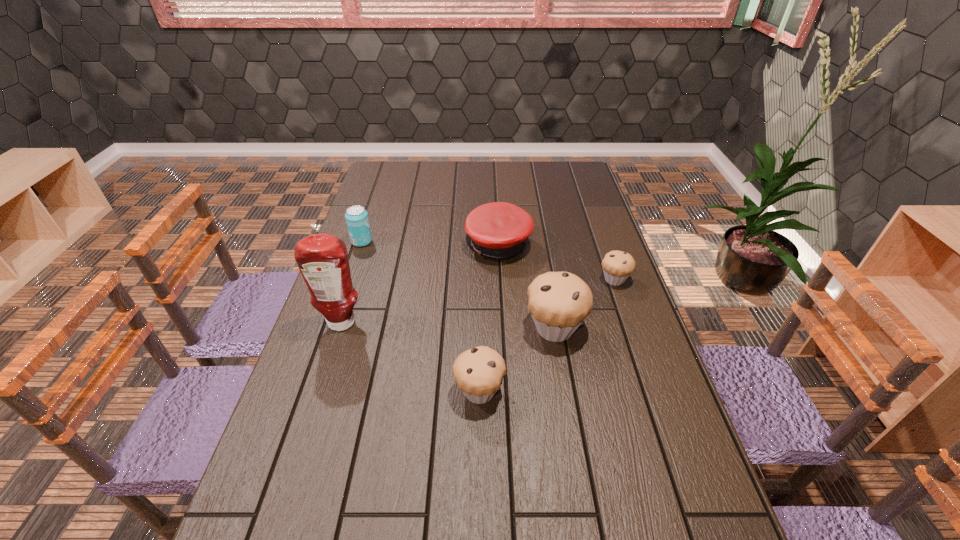
This screenshot has width=960, height=540. Identify the location of free space at the near edge of the desktop. (391, 523).

Locate an element on the screen. The image size is (960, 540). free space at the left edge of the desktop is located at coordinates (361, 292).

The image size is (960, 540). Find the location of `vacant space at the right edge of the desktop`. vacant space at the right edge of the desktop is located at coordinates (655, 396).

Where is `vacant region at the far left corner`? The height and width of the screenshot is (540, 960). vacant region at the far left corner is located at coordinates (396, 172).

The height and width of the screenshot is (540, 960). I want to click on blank region between the cap and the tallest object, so click(420, 284).

This screenshot has width=960, height=540. I want to click on vacant space that is in between the tallest muffin and the nearest muffin, so click(x=517, y=360).

Locate an element on the screen. This screenshot has width=960, height=540. free spot between the cap and the tallest object is located at coordinates (420, 284).

This screenshot has height=540, width=960. In order to click on vacant point located between the tallest object and the nearest object in this screenshot , I will do `click(410, 357)`.

You are a GUI agent. You are given a task and a screenshot of the screen. Output one action in this format:
    pyautogui.click(x=<x>, y=<y>)
    Task: Click on the free space between the beer can and the cap
    This screenshot has width=960, height=540.
    Given the screenshot: What is the action you would take?
    pyautogui.click(x=430, y=244)

You are a GUI agent. You are given a task and a screenshot of the screen. Output one action in this format:
    pyautogui.click(x=<x>, y=<y>)
    Task: Click on the unoccupied position between the second muffin from right to left and the condiment
    The height and width of the screenshot is (540, 960).
    Given the screenshot: What is the action you would take?
    pyautogui.click(x=448, y=326)